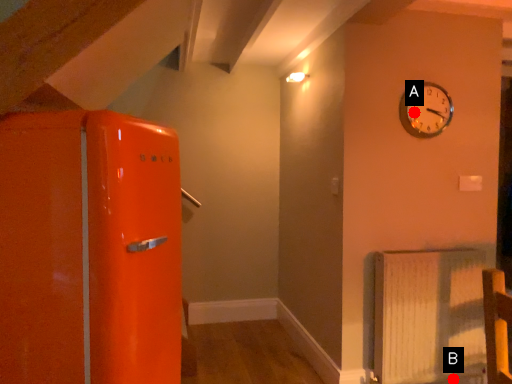
Question: Two points are circled on the image, labeled by A and B beside each circle. Among these points, which one is farthest from the camera?

Choices:
 (A) A is further
 (B) B is further

Answer: (A)